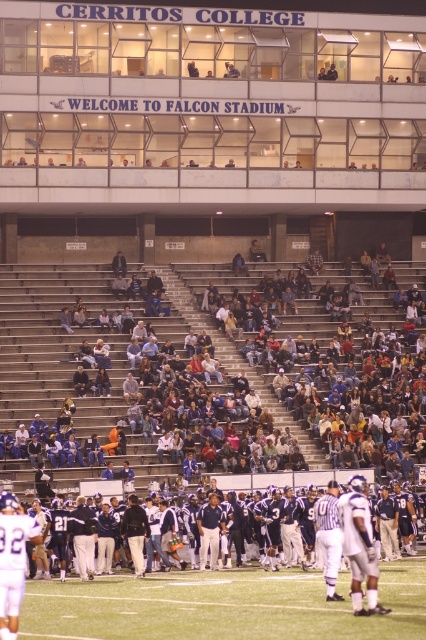
You are standing at the center of the football field and want to walk towards the closest point between point (32,620) and point (106,611). Which point should you head towards?

You should head towards point (32,620) because it is closer to the viewer than point (106,611).

You are a photographer standing at the edge of the green turf football field at center. You want to take a picture of the dark blue uniform at center so that it appears larger in the photo. What should you do?

To make the dark blue uniform at center appear larger in the photo, move closer to it since it is not as tall as the green turf football field at center, which means it might be smaller in size or positioned farther away.

You are a photographer trying to capture a closeup shot of the dark blue uniform at center. Since the green turf football field at center is in the background, will the uniform be in focus if you focus on the field?

The dark blue uniform at center is larger in size compared to the green turf football field at center, so focusing on the field may cause the uniform to be out of focus because it is closer to the camera than the field.